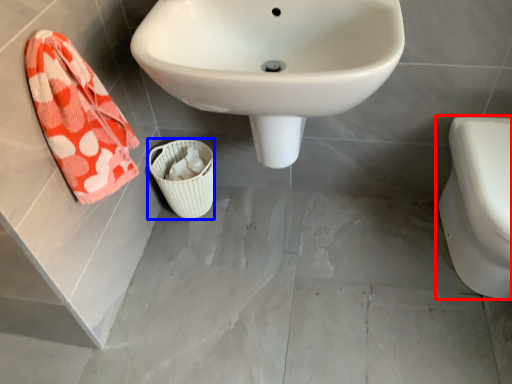
Question: Which object appears closest to the camera in this image, toilet (highlighted by a red box) or basket (highlighted by a blue box)?

Choices:
 (A) toilet
 (B) basket

Answer: (A)